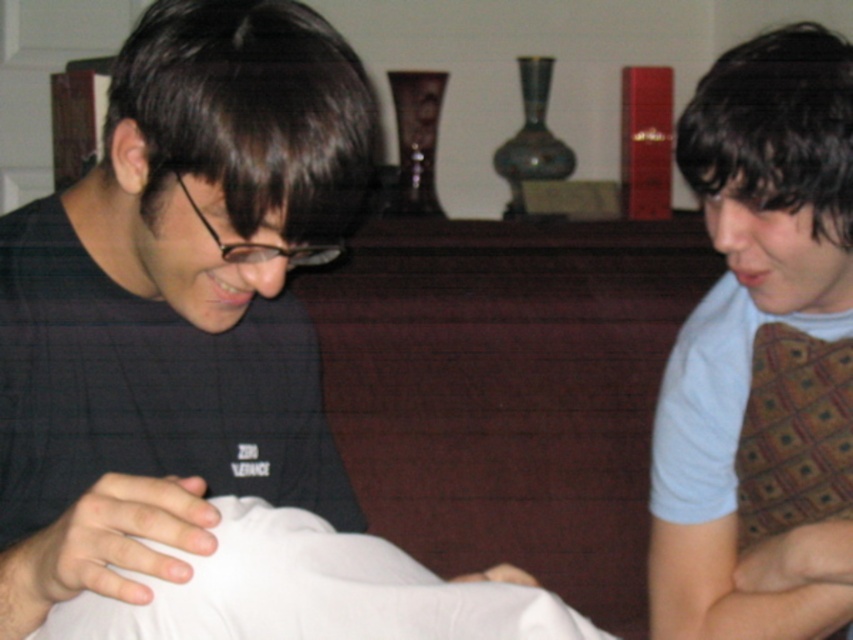
Question: Which point is closer to the camera?

Choices:
 (A) (785, 307)
 (B) (277, 522)

Answer: (B)

Question: Is white fabric at center closer to the viewer compared to light blue shirt at right?

Choices:
 (A) no
 (B) yes

Answer: (B)

Question: Is white fabric at center behind light blue shirt at right?

Choices:
 (A) no
 (B) yes

Answer: (A)

Question: Can you confirm if white fabric at center is smaller than light blue shirt at right?

Choices:
 (A) no
 (B) yes

Answer: (A)

Question: Which object is farther from the camera taking this photo?

Choices:
 (A) white fabric at center
 (B) light blue shirt at right

Answer: (B)